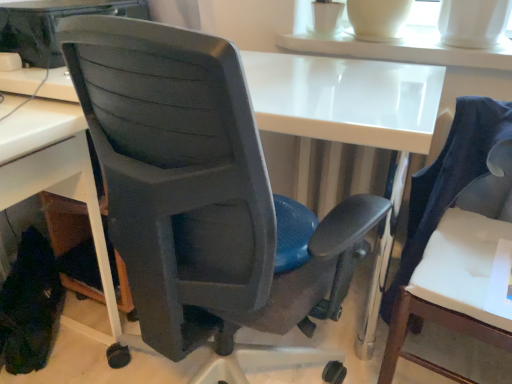
Question: Is matte plastic chair at center, the first chair from the left, completely or partially outside of white plastic desk at lower left?

Choices:
 (A) yes
 (B) no

Answer: (A)

Question: From a real-world perspective, does matte plastic chair at center, the first chair from the left, sit lower than white plastic desk at lower left?

Choices:
 (A) no
 (B) yes

Answer: (A)

Question: From the image's perspective, is matte plastic chair at center, marked as the second chair in a right-to-left arrangement, below white plastic desk at lower left?

Choices:
 (A) no
 (B) yes

Answer: (A)

Question: Can you confirm if matte plastic chair at center, the first chair from the left, is smaller than white plastic desk at lower left?

Choices:
 (A) yes
 (B) no

Answer: (B)

Question: Considering the relative sizes of matte plastic chair at center, the first chair from the left, and white plastic desk at lower left in the image provided, is matte plastic chair at center, the first chair from the left, bigger than white plastic desk at lower left?

Choices:
 (A) no
 (B) yes

Answer: (B)

Question: In terms of size, does white glossy table at upper center appear bigger or smaller than matte plastic chair at center, marked as the second chair in a right-to-left arrangement?

Choices:
 (A) big
 (B) small

Answer: (B)

Question: From a real-world perspective, is white glossy table at upper center physically located above or below matte plastic chair at center, the first chair from the left?

Choices:
 (A) below
 (B) above

Answer: (B)

Question: From their relative heights in the image, would you say white glossy table at upper center is taller or shorter than matte plastic chair at center, the first chair from the left?

Choices:
 (A) tall
 (B) short

Answer: (B)

Question: Would you say white glossy table at upper center is to the left or to the right of matte plastic chair at center, marked as the second chair in a right-to-left arrangement, in the picture?

Choices:
 (A) left
 (B) right

Answer: (B)

Question: Based on their sizes in the image, would you say white fabric chair at right, arranged as the 2th chair when viewed from the left, is bigger or smaller than white glossy table at upper center?

Choices:
 (A) big
 (B) small

Answer: (A)

Question: Is white fabric chair at right, the 1th chair viewed from the right, taller or shorter than white glossy table at upper center?

Choices:
 (A) short
 (B) tall

Answer: (B)

Question: Do you think white fabric chair at right, the 1th chair viewed from the right, is within white glossy table at upper center, or outside of it?

Choices:
 (A) inside
 (B) outside

Answer: (B)

Question: Considering the relative positions of white fabric chair at right, arranged as the 2th chair when viewed from the left, and white glossy table at upper center in the image provided, is white fabric chair at right, arranged as the 2th chair when viewed from the left, to the left or to the right of white glossy table at upper center?

Choices:
 (A) right
 (B) left

Answer: (A)

Question: Is white plastic desk at lower left inside or outside of white fabric chair at right, the 1th chair viewed from the right?

Choices:
 (A) inside
 (B) outside

Answer: (B)

Question: From a real-world perspective, is white plastic desk at lower left physically located above or below white fabric chair at right, arranged as the 2th chair when viewed from the left?

Choices:
 (A) above
 (B) below

Answer: (B)